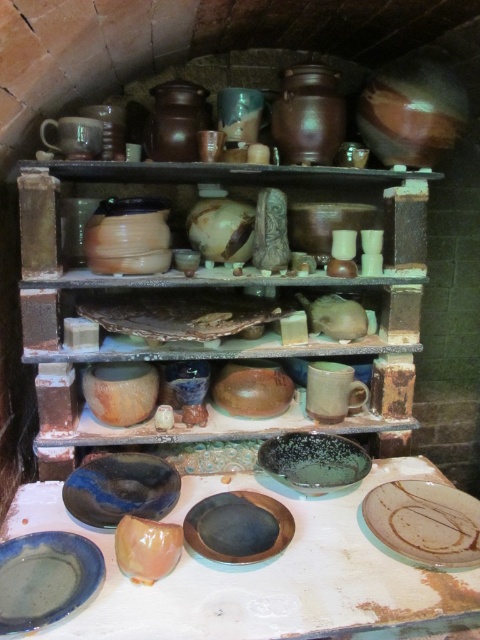
Which is above, green matte plate at center or matte clay mug at center?

matte clay mug at center is above.

Between point (439, 512) and point (312, 365), which one is positioned behind?

The point (312, 365) is more distant.

At what (x,y) coordinates should I click in order to perform the action: click on green matte plate at center. Please return your answer as a coordinate pair (x, y). The height and width of the screenshot is (640, 480). Looking at the image, I should click on (423, 524).

In the scene shown: Does green matte plate at center appear under blue glossy plate at center?

Indeed, green matte plate at center is positioned under blue glossy plate at center.

Is the position of green matte plate at center less distant than that of blue glossy plate at center?

Yes, green matte plate at center is closer to the viewer.

Describe the element at coordinates (423, 524) in the screenshot. I see `green matte plate at center` at that location.

This screenshot has width=480, height=640. Identify the location of green matte plate at center. (423, 524).

The height and width of the screenshot is (640, 480). Describe the element at coordinates (214, 292) in the screenshot. I see `matte ceramic plate at center` at that location.

Between matte ceramic plate at center and matte clay mug at center, which one has less height?

matte clay mug at center

Where is `matte ceramic plate at center`? The image size is (480, 640). matte ceramic plate at center is located at coordinates (214, 292).